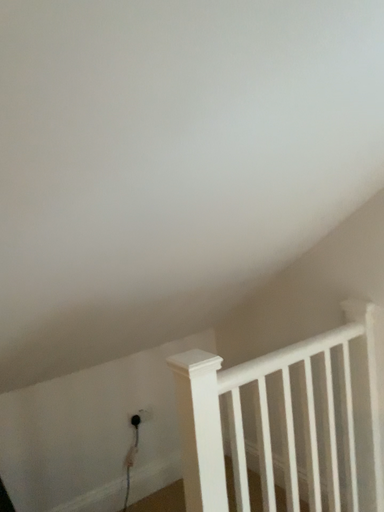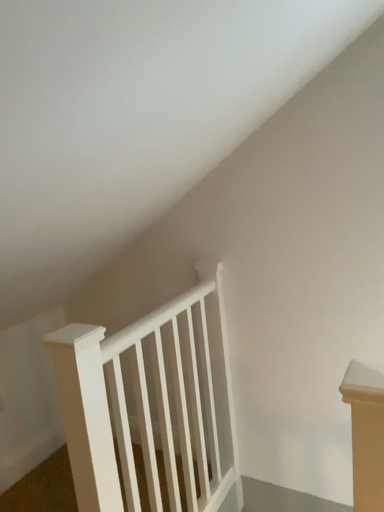
Question: Which way did the camera rotate in the video?

Choices:
 (A) rotated left
 (B) rotated right

Answer: (B)